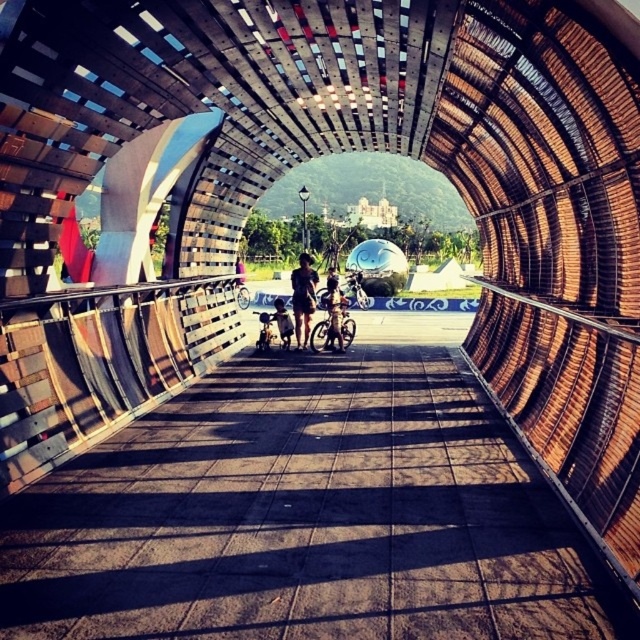
Question: Where is matte black bicycle at center located in relation to metallic silver bicycle at center in the image?

Choices:
 (A) above
 (B) below

Answer: (A)

Question: Among these objects, which one is farthest from the camera?

Choices:
 (A) brown concrete path at center
 (B) silver metallic bicycle at center
 (C) dark brown shorts at center

Answer: (B)

Question: Does brown concrete path at center have a larger size compared to metallic silver bicycle at center?

Choices:
 (A) no
 (B) yes

Answer: (A)

Question: Which point is farther to the camera?

Choices:
 (A) (296, 308)
 (B) (328, 285)
 (C) (236, 292)

Answer: (C)

Question: Does brown concrete path at center appear under dark brown shorts at center?

Choices:
 (A) no
 (B) yes

Answer: (B)

Question: Which point appears farthest from the camera in this image?

Choices:
 (A) (298, 333)
 (B) (314, 348)
 (C) (332, 340)

Answer: (B)